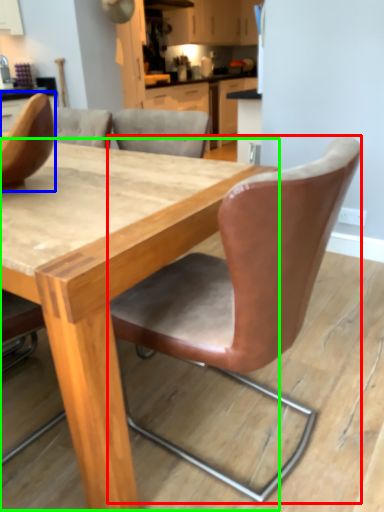
Question: Which object is positioned farthest from chair (highlighted by a red box)? Select from chair (highlighted by a blue box) and table (highlighted by a green box).

Choices:
 (A) chair
 (B) table

Answer: (A)